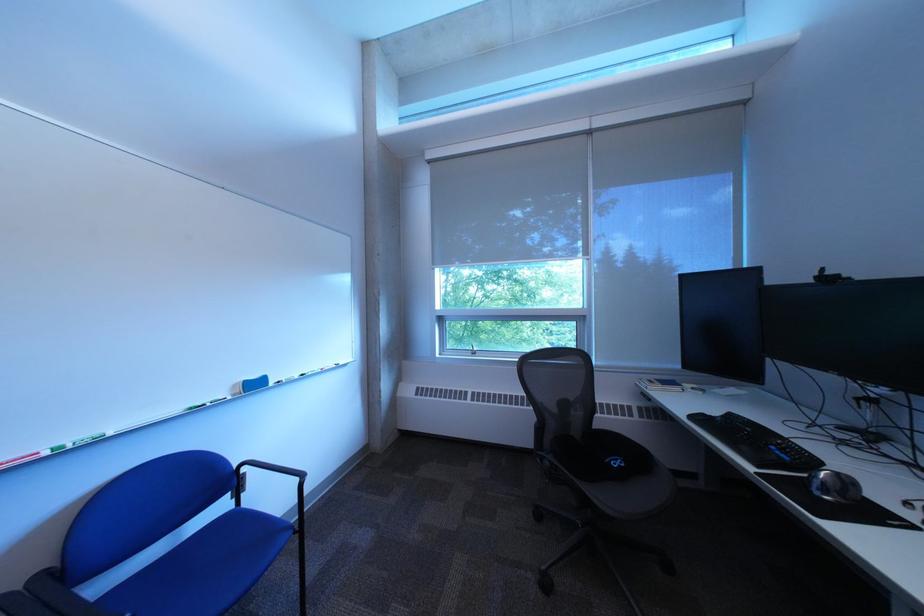
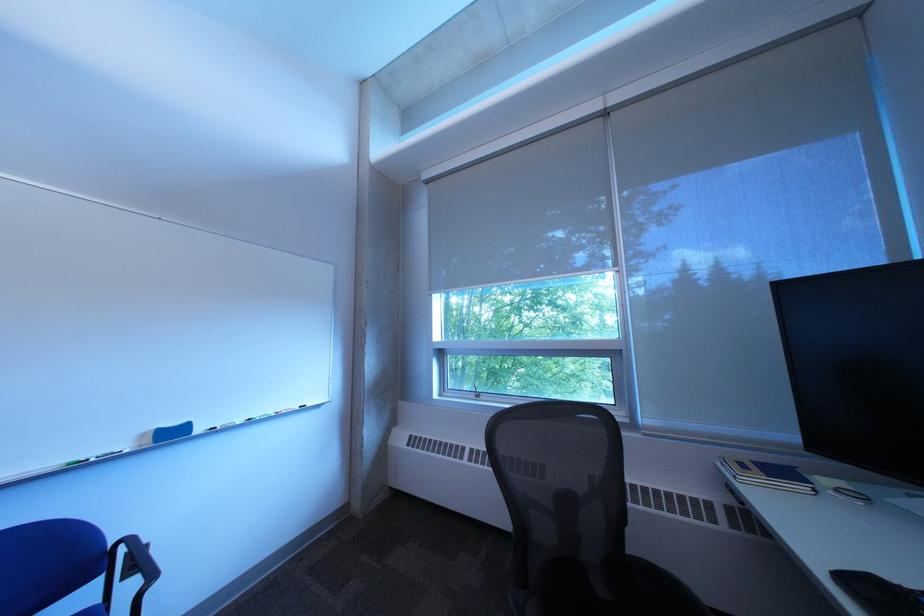
Where in the second image is the point corresponding to [651,386] from the first image?

(733, 468)